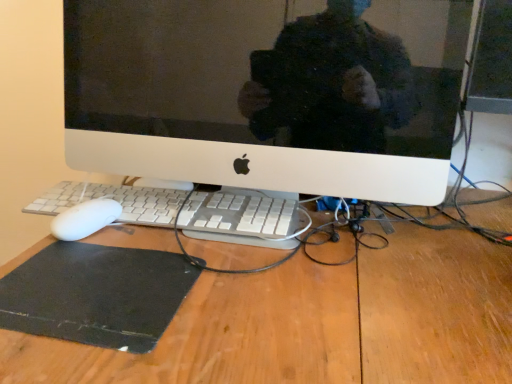
Identify the location of vacant area that lies to the right of black rubber mousepad at lower left. The image size is (512, 384). (258, 296).